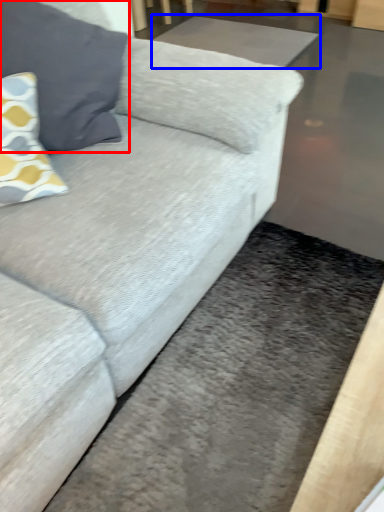
Question: Which object is closer to the camera taking this photo, pillow (highlighted by a red box) or flat (highlighted by a blue box)?

Choices:
 (A) pillow
 (B) flat

Answer: (A)